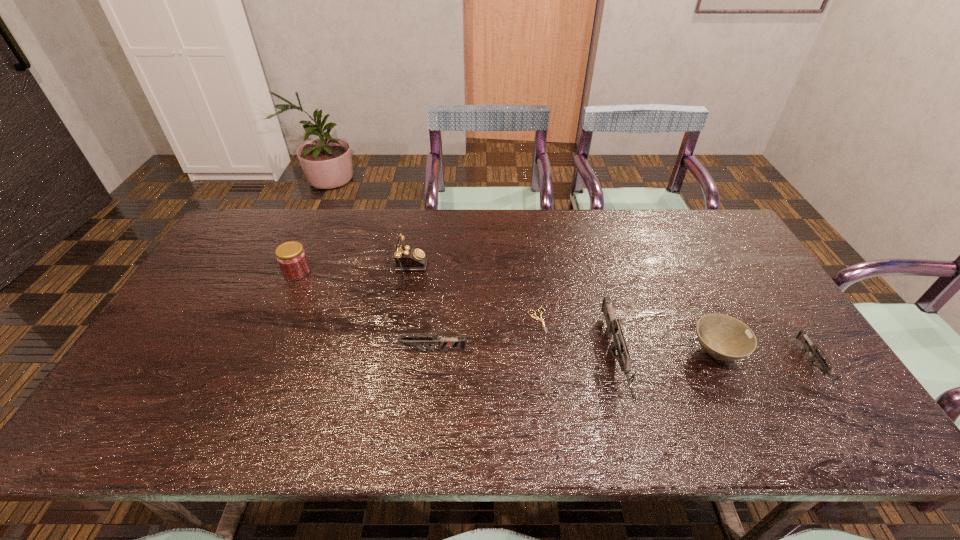
Find the location of a particular element. Image resolution: width=960 pixels, height=540 pixels. free space located aimed along the barrel of the second tallest gun is located at coordinates (249, 352).

You are a GUI agent. You are given a task and a screenshot of the screen. Output one action in this format:
    pyautogui.click(x=<x>, y=<y>)
    Task: Click on the free space located aimed along the barrel of the second tallest gun
    
    Given the screenshot: What is the action you would take?
    pyautogui.click(x=337, y=352)

Identify the location of vacant region located 0.390m aimed along the barrel of the second tallest gun. [229, 352].

You are a GUI agent. You are given a task and a screenshot of the screen. Output one action in this format:
    pyautogui.click(x=<x>, y=<y>)
    Task: Click on the vacant space located on the right of the leftmost object
    Image resolution: width=960 pixels, height=540 pixels.
    Given the screenshot: What is the action you would take?
    pyautogui.click(x=375, y=272)

This screenshot has height=540, width=960. I want to click on vacant area located on the back of the shortest object, so click(529, 251).

Find the location of `vacant space positioned 0.160m on the dial of the telephone`. vacant space positioned 0.160m on the dial of the telephone is located at coordinates (478, 279).

The image size is (960, 540). Find the location of `free space located on the left of the second object from right to left`. free space located on the left of the second object from right to left is located at coordinates (546, 353).

This screenshot has width=960, height=540. In order to click on bowl situated at the near edge in this screenshot , I will do `click(723, 337)`.

This screenshot has width=960, height=540. What are the coordinates of `object present at the right edge` in the screenshot? It's located at (802, 336).

The image size is (960, 540). Identify the location of object present at the near right corner. (802, 336).